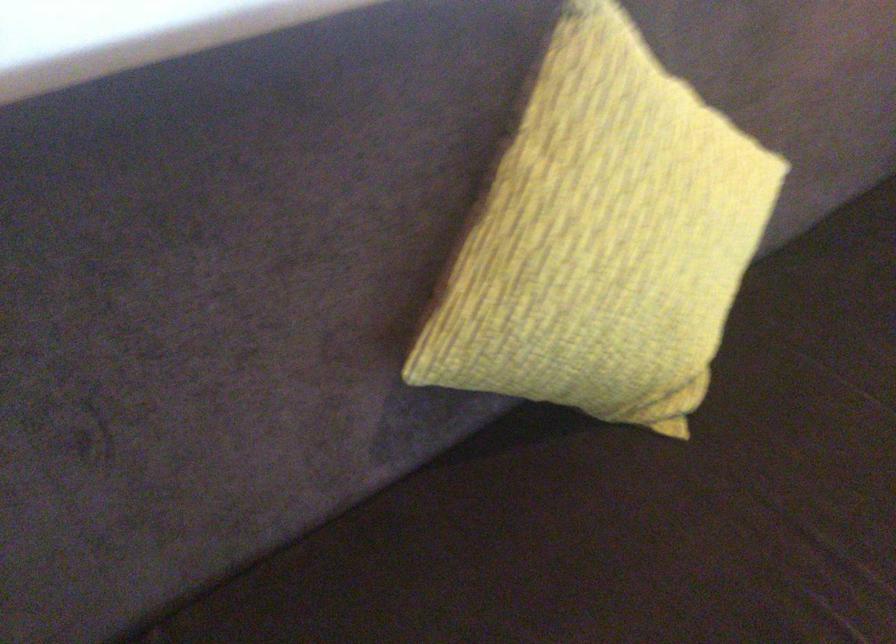
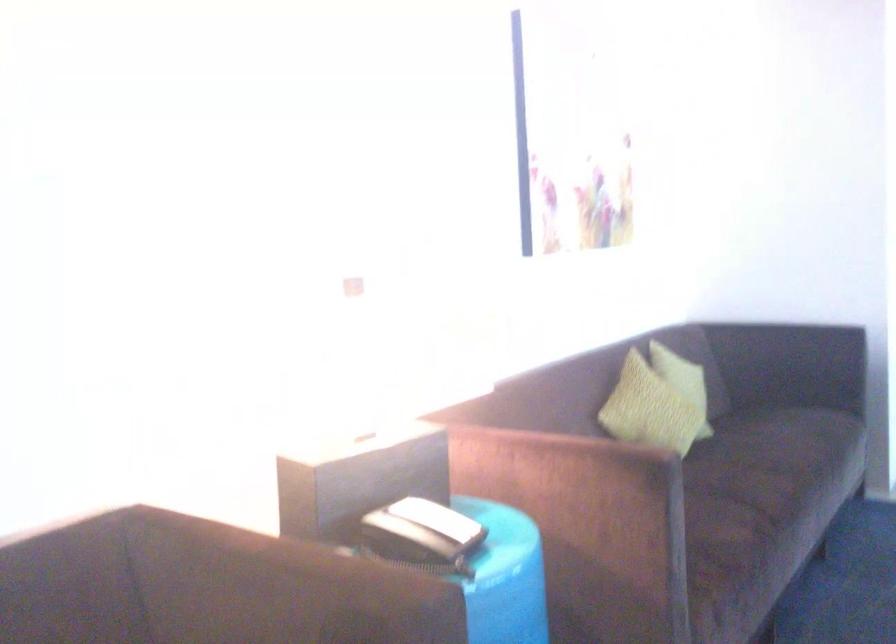
First-person continuous shooting, in which direction is the camera rotating?

The camera's rotation is toward right-up.